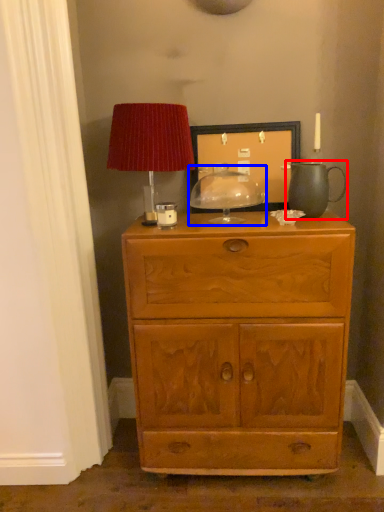
Question: Which point is closer to the camera, tea pot (highlighted by a red box) or candle holder (highlighted by a blue box)?

Choices:
 (A) tea pot
 (B) candle holder

Answer: (A)